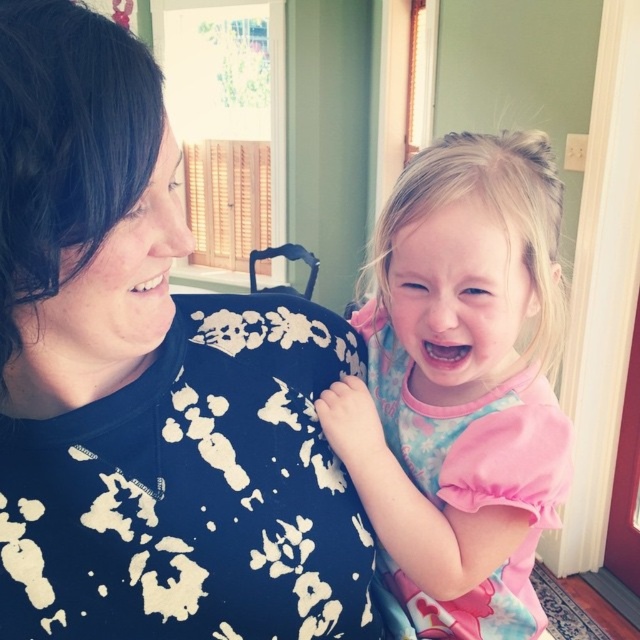
Is black floral shirt at upper left bigger than pink fabric dress at center?

No, black floral shirt at upper left is not bigger than pink fabric dress at center.

Is black floral shirt at upper left taller than pink fabric dress at center?

No.

Measure the distance between point (157, 372) and camera.

Point (157, 372) and camera are 24.05 inches apart.

You are a GUI agent. You are given a task and a screenshot of the screen. Output one action in this format:
    pyautogui.click(x=<x>, y=<y>)
    Task: Click on the black floral shirt at upper left
    The width and height of the screenshot is (640, 640).
    Given the screenshot: What is the action you would take?
    [148, 381]